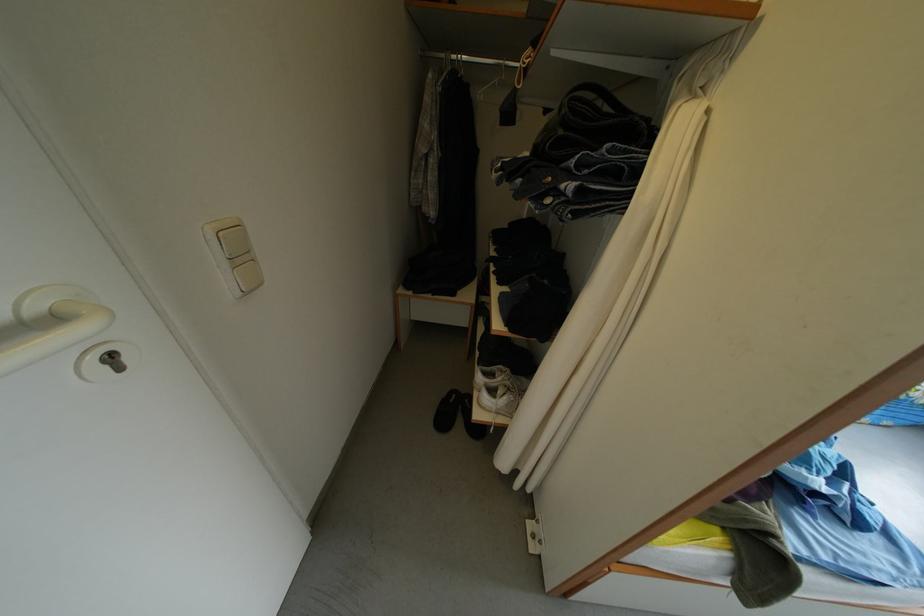
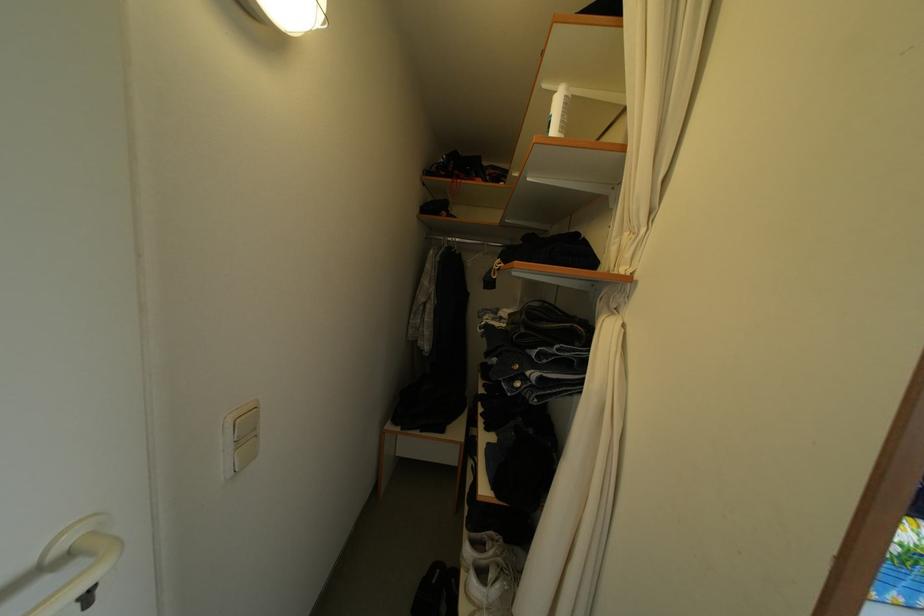
Question: What movement of the cameraman would produce the second image?

Choices:
 (A) Left
 (B) Right
 (C) Forward
 (D) Backward

Answer: (D)